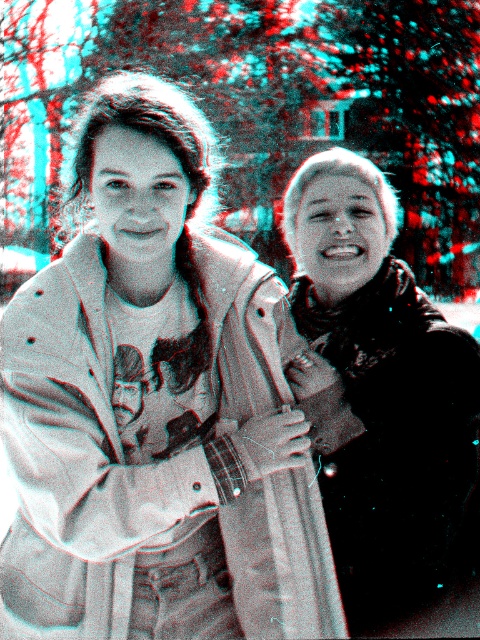
Identify the location of light beige textured trench coat at center. Image resolution: width=480 pixels, height=640 pixels. (75, 456).

Is light beige textured trench coat at center wider than velvet black scarf at right?

Yes.

Describe the element at coordinates (75, 456) in the screenshot. I see `light beige textured trench coat at center` at that location.

Where is `light beige textured trench coat at center`? This screenshot has width=480, height=640. light beige textured trench coat at center is located at coordinates tap(75, 456).